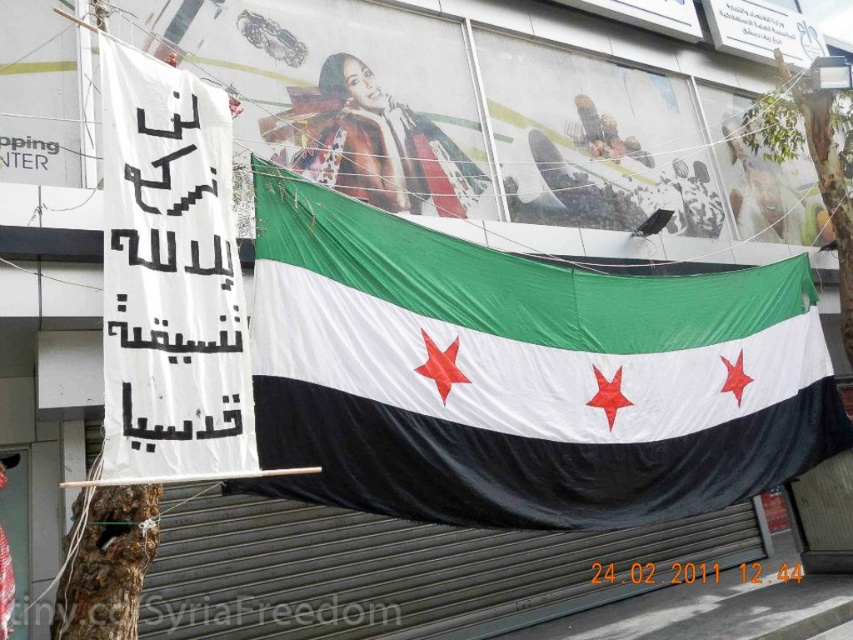
You are a drone operator tasked with capturing aerial footage of the Syrian opposition flag displayed outside the building. The flag is located at the center of the scene. There is a banner with Arabic text to the left of the flag. Your drone must avoid flying too close to the flag to prevent damage. If the point you are targeting is at coordinates point (520, 376), is this point likely to be within the flag area?

The point (520, 376) is where the textured fabric flag at center is located, so yes, this point is within the flag area and the drone should avoid it to prevent damage.

You are a photographer trying to capture both the textured fabric flag at center and the matte red scarf at center in a single shot. Given their sizes, which object should you focus on to ensure both are visible in the frame without needing to zoom in or out?

Since the textured fabric flag at center is larger than the matte red scarf at center, you should focus on the textured fabric flag at center to ensure both objects fit within the frame.